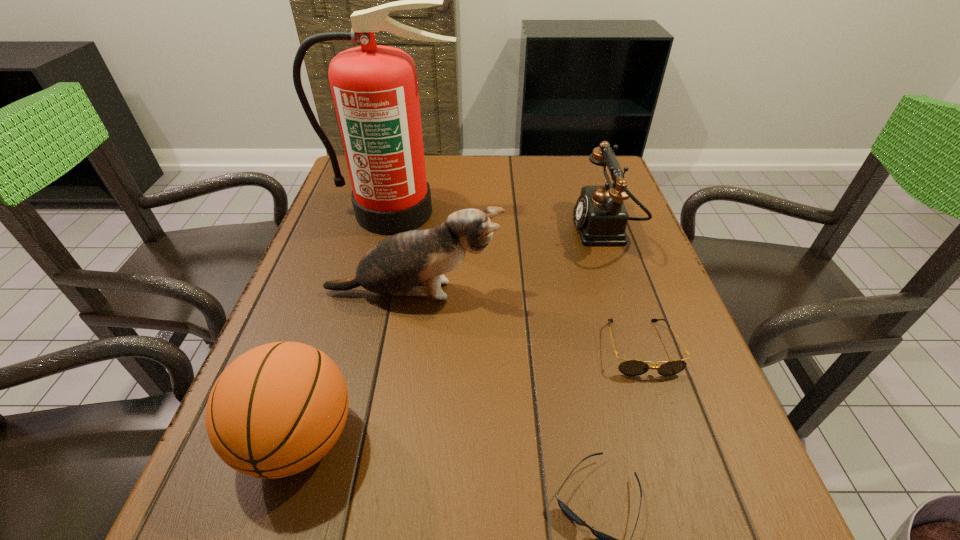
Locate an element on the screen. the tallest object is located at coordinates click(x=374, y=88).

The image size is (960, 540). In order to click on the fourth nearest object in this screenshot , I will do `click(394, 266)`.

At what (x,y) coordinates should I click in order to perform the action: click on telephone. Please return your answer as a coordinate pair (x, y). Looking at the image, I should click on (600, 215).

Find the location of a particular element. The width and height of the screenshot is (960, 540). basketball is located at coordinates (276, 410).

Where is `the farther sunglasses`? Image resolution: width=960 pixels, height=540 pixels. the farther sunglasses is located at coordinates (629, 367).

Identify the location of the right sunglasses. (629, 367).

Where is `free space located at the nozzle of the tallest object`? The width and height of the screenshot is (960, 540). free space located at the nozzle of the tallest object is located at coordinates (364, 341).

At what (x,y) coordinates should I click in order to perform the action: click on free point located 0.280m at the face of the fourth nearest object. Please return your answer as a coordinate pair (x, y). This screenshot has width=960, height=540. Looking at the image, I should click on (627, 293).

Find the location of a particular element. vacant space positioned on the front of the telephone at the rotary dial is located at coordinates (434, 230).

Locate an element on the screen. The width and height of the screenshot is (960, 540). free space located 0.070m on the front of the telephone at the rotary dial is located at coordinates (547, 230).